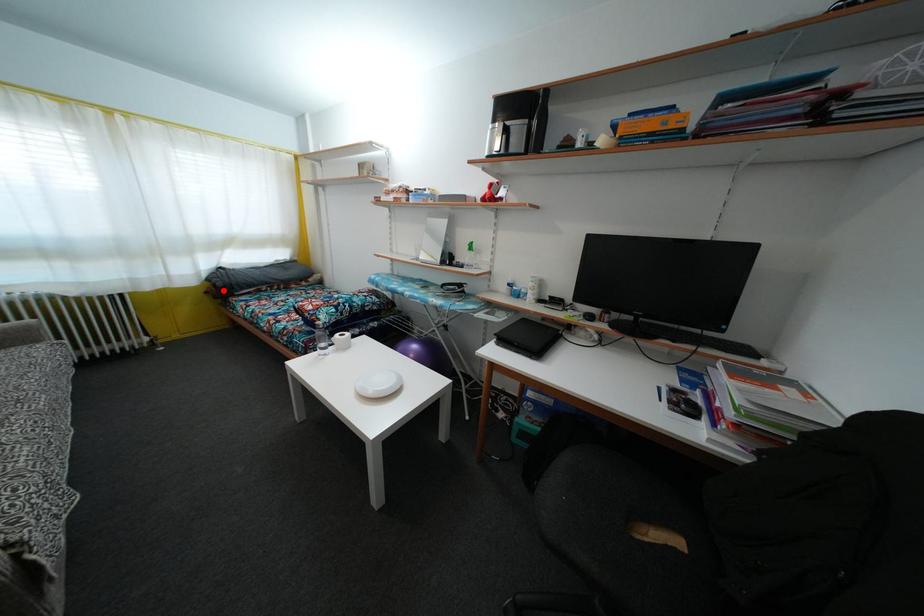
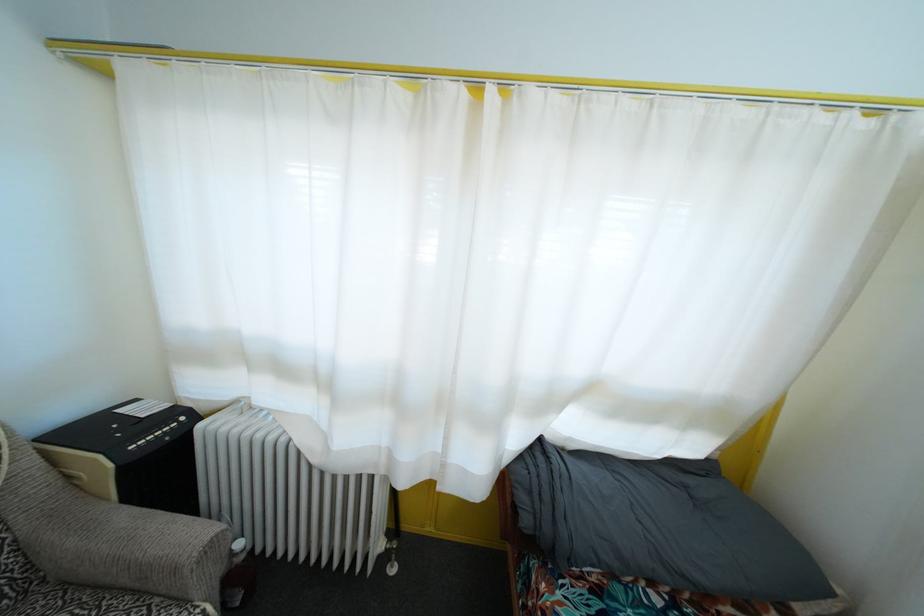
Find the pixel in the second image that matches the highlighted location in the first image.

(529, 528)